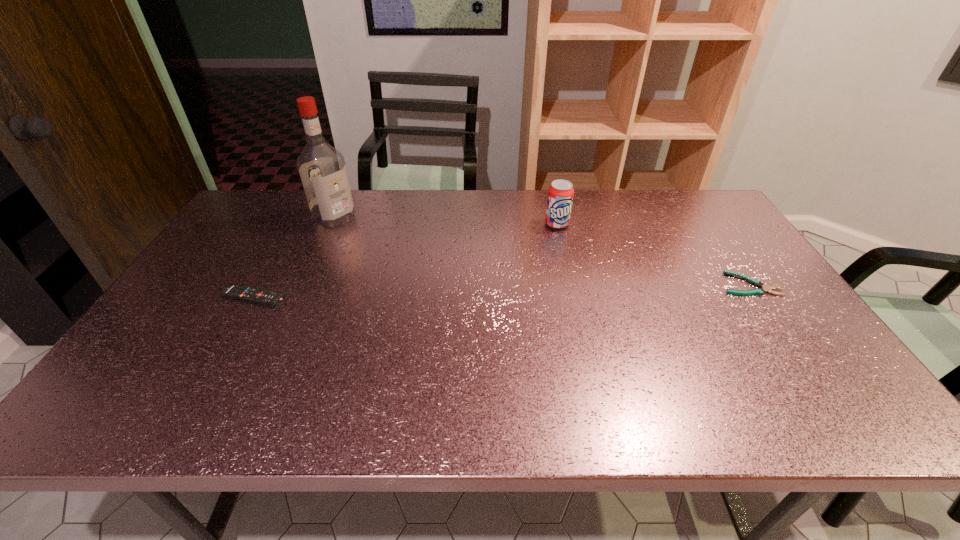
Image resolution: width=960 pixels, height=540 pixels. Find the location of `unoccupied area between the liquor and the third object from left to right`. unoccupied area between the liquor and the third object from left to right is located at coordinates (445, 221).

Find the location of a particular element. This screenshot has height=540, width=960. free spot between the soda can and the remote control is located at coordinates [x=406, y=261].

You are a GUI agent. You are given a task and a screenshot of the screen. Output one action in this format:
    pyautogui.click(x=<x>, y=<y>)
    Task: Click on the empty space that is in between the liquor and the soda can
    The width and height of the screenshot is (960, 540).
    Given the screenshot: What is the action you would take?
    pyautogui.click(x=445, y=221)

Locate an element on the screen. This screenshot has width=960, height=540. free point between the remote control and the tallest object is located at coordinates (295, 258).

Where is `empty space that is in between the second object from right to left and the rightmost object`? The width and height of the screenshot is (960, 540). empty space that is in between the second object from right to left and the rightmost object is located at coordinates (653, 254).

Find the location of `free space between the third tallest object and the tallest object`. free space between the third tallest object and the tallest object is located at coordinates (295, 258).

Select which object is the closest to the pliers. Please provide its 2D coordinates. Your answer should be formatted as a tuple, i.e. [(x, y)], where the tuple contains the x and y coordinates of a point satisfying the conditions above.

[(560, 194)]

The width and height of the screenshot is (960, 540). In order to click on object that is the nearest to the tallest object in this screenshot , I will do `click(240, 292)`.

Identify the location of vacant space that satisfies the following two spatial constraints: 1. on the back side of the pliers; 2. on the left side of the remote control. The width and height of the screenshot is (960, 540). (263, 284).